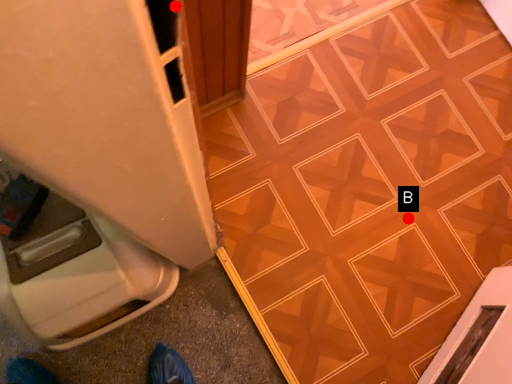
Question: Two points are circled on the image, labeled by A and B beside each circle. Which point is farther to the camera?

Choices:
 (A) A is further
 (B) B is further

Answer: (B)